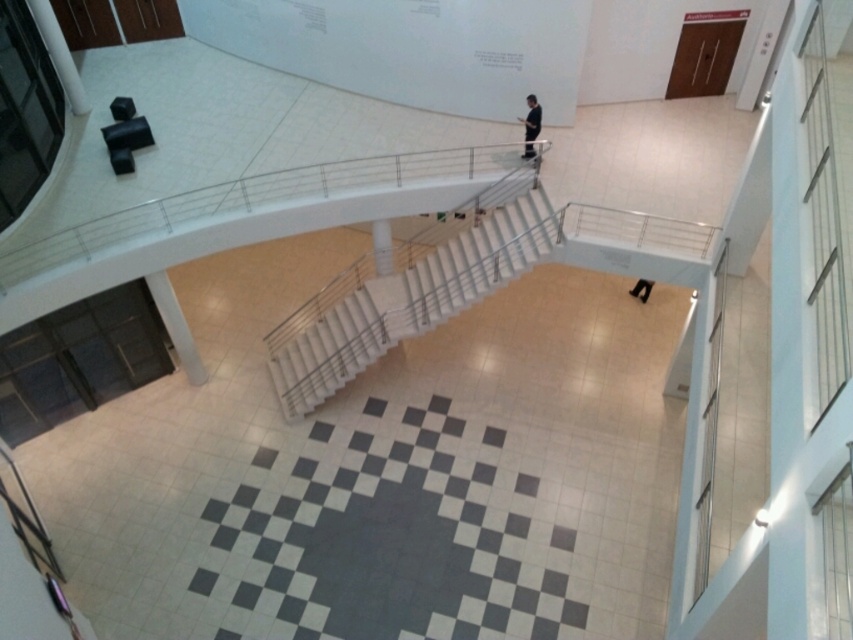
Question: Which point appears farthest from the camera in this image?

Choices:
 (A) (647, 291)
 (B) (540, 116)
 (C) (403, 276)

Answer: (A)

Question: Does black smooth suit at center appear on the left side of black leather shoes at lower center?

Choices:
 (A) yes
 (B) no

Answer: (A)

Question: Is white glossy stairs at center thinner than black smooth suit at center?

Choices:
 (A) no
 (B) yes

Answer: (A)

Question: Which object is the farthest from the black smooth suit at center?

Choices:
 (A) white glossy stairs at center
 (B) black leather shoes at lower center

Answer: (B)

Question: Does black smooth suit at center appear on the left side of black leather shoes at lower center?

Choices:
 (A) yes
 (B) no

Answer: (A)

Question: Among these objects, which one is farthest from the camera?

Choices:
 (A) black leather shoes at lower center
 (B) white glossy stairs at center
 (C) black smooth suit at center

Answer: (A)